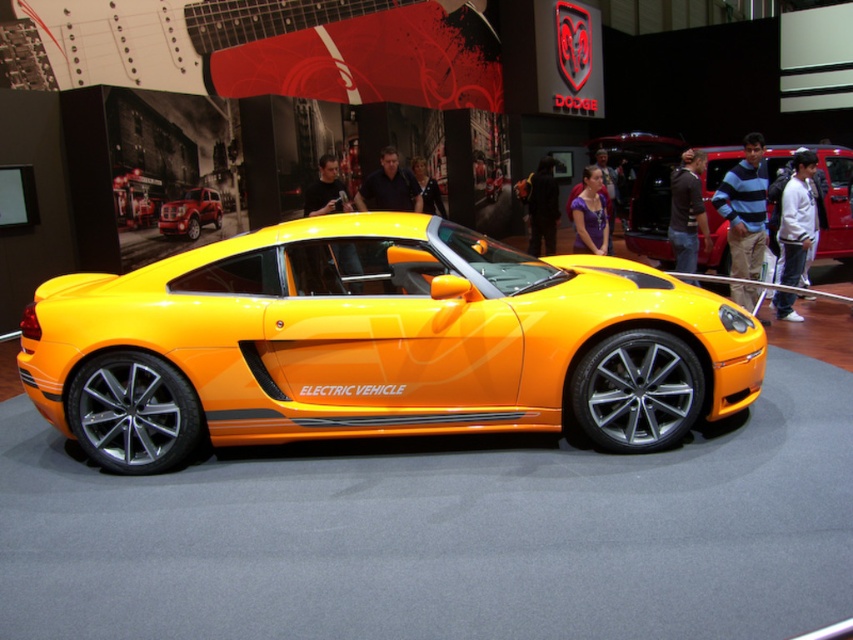
You are standing at the entrance of the exhibition and want to take a photo of both the shiny metallic car at center and the shiny red suv at center. Which car should you position yourself to the left of to capture both in the frame?

You should position yourself to the left of the shiny red suv at center. Since the shiny metallic car at center is to the right of the shiny red suv at center, this positioning will allow both vehicles to be captured in the frame.

You are standing at the entrance of the exhibition hall and see a point marked at coordinates (376,342). What object is located at that point?

The shiny orange electric vehicle at center is located at point (376,342).

You are at an auto show and notice two vehicles at the center of the image. The shiny orange electric vehicle at center and the shiny metallic car at center. Which one is placed higher up?

The shiny orange electric vehicle at center is positioned under the shiny metallic car at center, so the shiny metallic car at center is placed higher up.